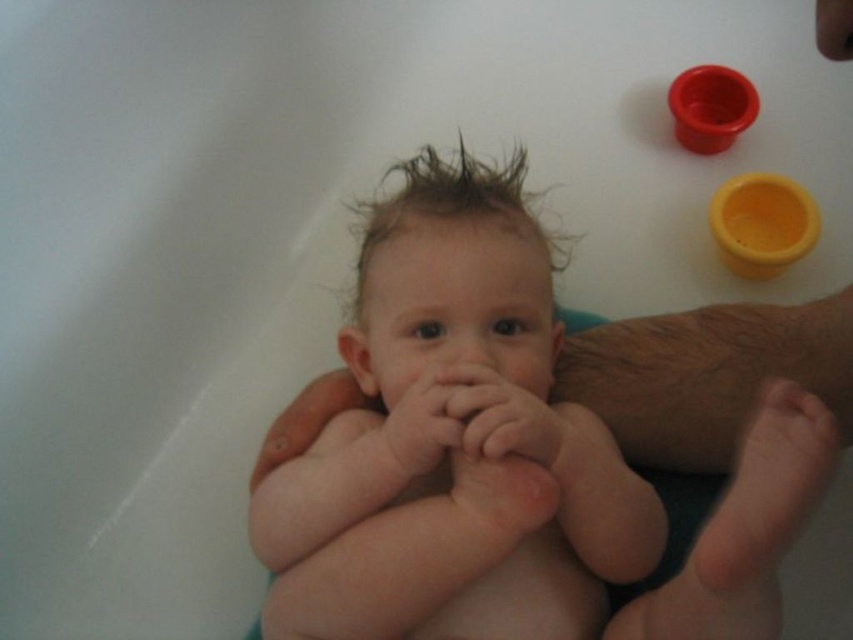
You are a photographer taking a picture of a baby in a white bathtub. You notice two points marked in the image. The first point is at coordinates point (815, 237) and the second is at point (735, 109). If you want to focus on the point that is closer to the camera, which coordinate should you choose?

Point (815, 237) is in front of point (735, 109), so you should focus on point (815, 237) to capture the closer one.

You are a photographer taking a closeup shot of the baby in the tub. You need to ensure both the pink soft skin at center and the yellow matte cup at upper right are in focus. Which object should you position your camera closer to first?

The pink soft skin at center is positioned on the left side of yellow matte cup at upper right, so you should position your camera closer to the pink soft skin at center first to ensure both are in focus.

What is located at the coordinates point (480, 416) in the image?

The point (480, 416) indicates pink soft skin at center.